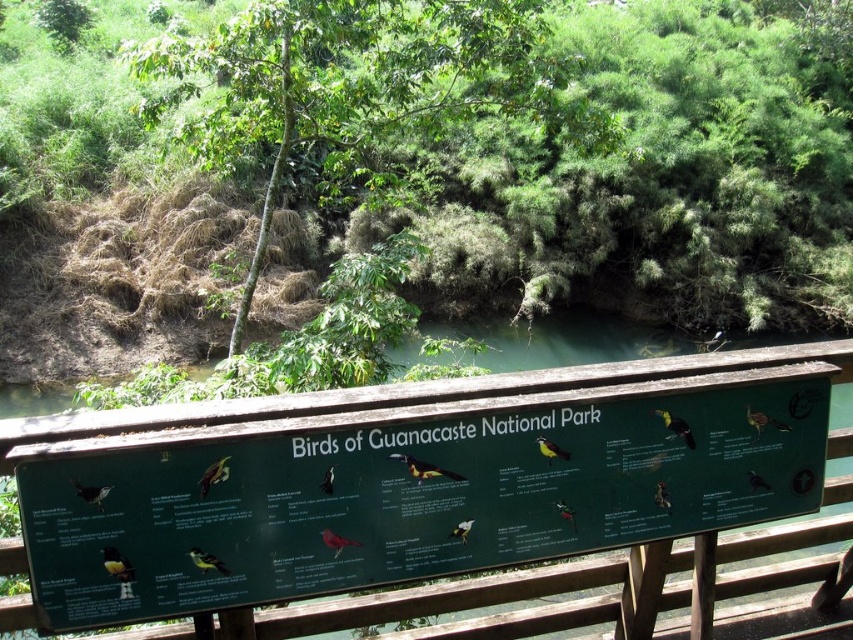
Is green matte signboard at center positioned at the back of green leafy tree at upper center?

That is False.

Which is behind, point (602, 509) or point (253, 26)?

Point (253, 26)

Between point (71, 476) and point (595, 104), which one is positioned in front?

Positioned in front is point (71, 476).

Find the location of a particular element. Image resolution: width=853 pixels, height=640 pixels. green matte signboard at center is located at coordinates (408, 490).